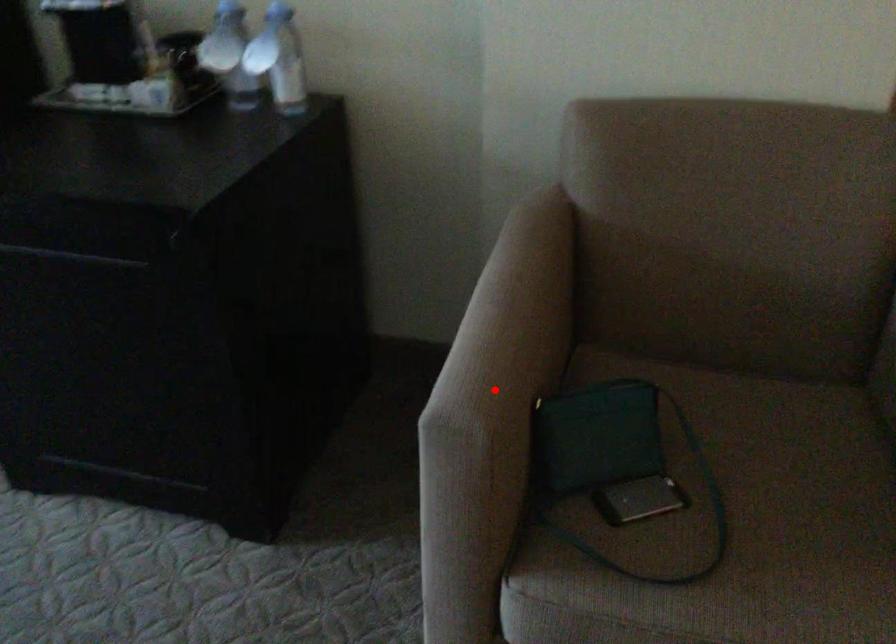
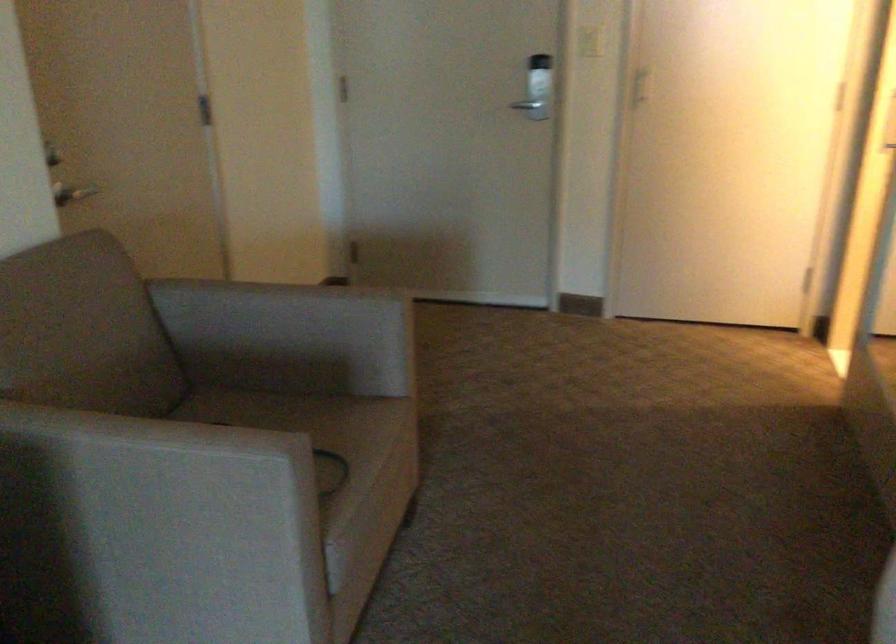
In the second image, find the point that corresponds to the highlighted location in the first image.

(266, 431)